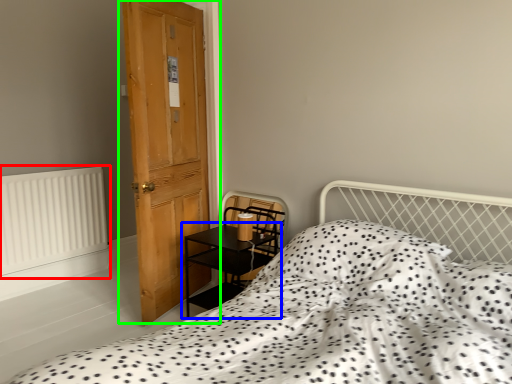
Question: Which object is the farthest from radiator (highlighted by a red box)? Choose among these: table (highlighted by a blue box) or door (highlighted by a green box).

Choices:
 (A) table
 (B) door

Answer: (A)